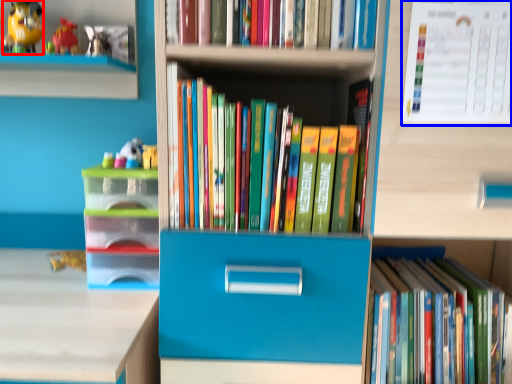
Question: Which object appears farthest to the camera in this image, toy (highlighted by a red box) or paperback book (highlighted by a blue box)?

Choices:
 (A) toy
 (B) paperback book

Answer: (A)